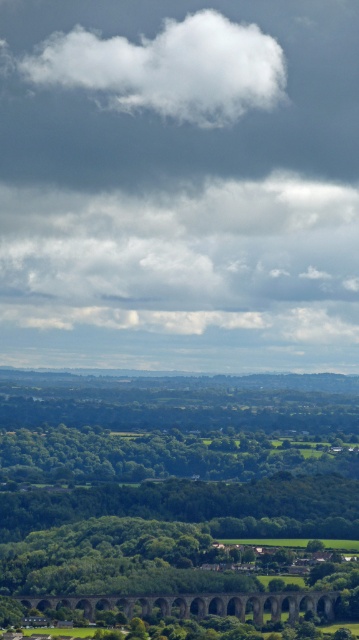
Question: Can you confirm if white fluffy cloud at upper center is positioned to the right of brown stone viaduct at lower center?

Choices:
 (A) yes
 (B) no

Answer: (B)

Question: Can you confirm if green grassy field at lower center is bigger than white fluffy cloud at upper center?

Choices:
 (A) yes
 (B) no

Answer: (A)

Question: Does green grassy field at lower center have a larger size compared to white fluffy cloud at upper center?

Choices:
 (A) yes
 (B) no

Answer: (A)

Question: Which point appears closest to the camera in this image?

Choices:
 (A) (91, 547)
 (B) (182, 605)
 (C) (146, 93)

Answer: (A)

Question: Which object appears farthest from the camera in this image?

Choices:
 (A) brown stone viaduct at lower center
 (B) white fluffy cloud at upper center
 (C) green grassy field at lower center

Answer: (A)

Question: Which of the following is the farthest from the observer?

Choices:
 (A) (122, 609)
 (B) (146, 595)
 (C) (206, 26)

Answer: (C)